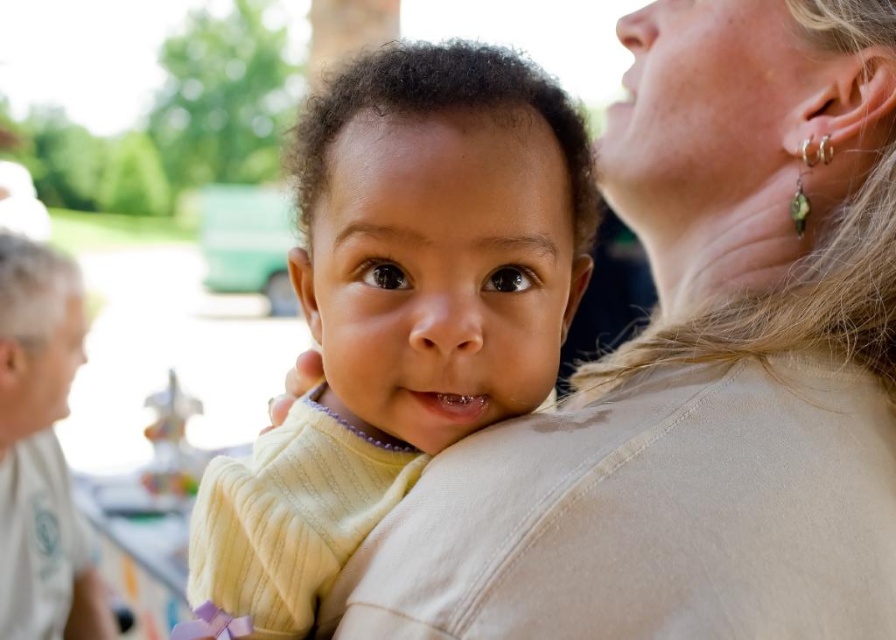
Question: Is smooth beige sweater at upper right above soft yellow sweater at center?

Choices:
 (A) no
 (B) yes

Answer: (B)

Question: Does smooth beige sweater at upper right have a smaller size compared to soft yellow sweater at center?

Choices:
 (A) yes
 (B) no

Answer: (B)

Question: Which of the following is the closest to the observer?

Choices:
 (A) (414, 561)
 (B) (455, 100)

Answer: (A)

Question: Is smooth beige sweater at upper right above soft yellow sweater at center?

Choices:
 (A) no
 (B) yes

Answer: (B)

Question: Which point appears farthest from the camera in this image?

Choices:
 (A) (665, 566)
 (B) (383, 321)

Answer: (B)

Question: Which point is farther to the camera?

Choices:
 (A) (797, 301)
 (B) (402, 404)

Answer: (A)